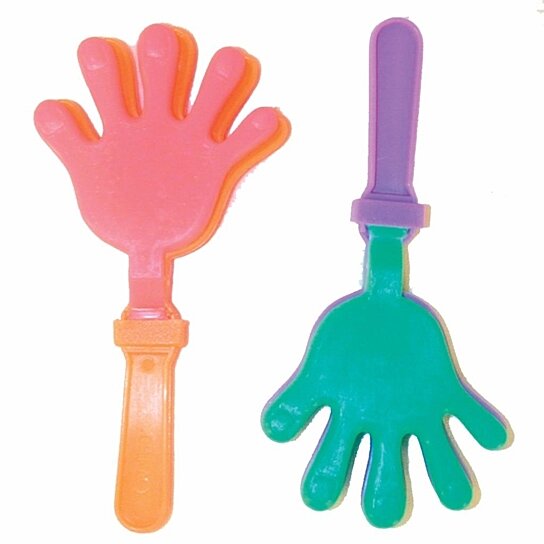
What are the coordinates of `plastic toy` in the screenshot? It's located at (154, 331), (398, 203).